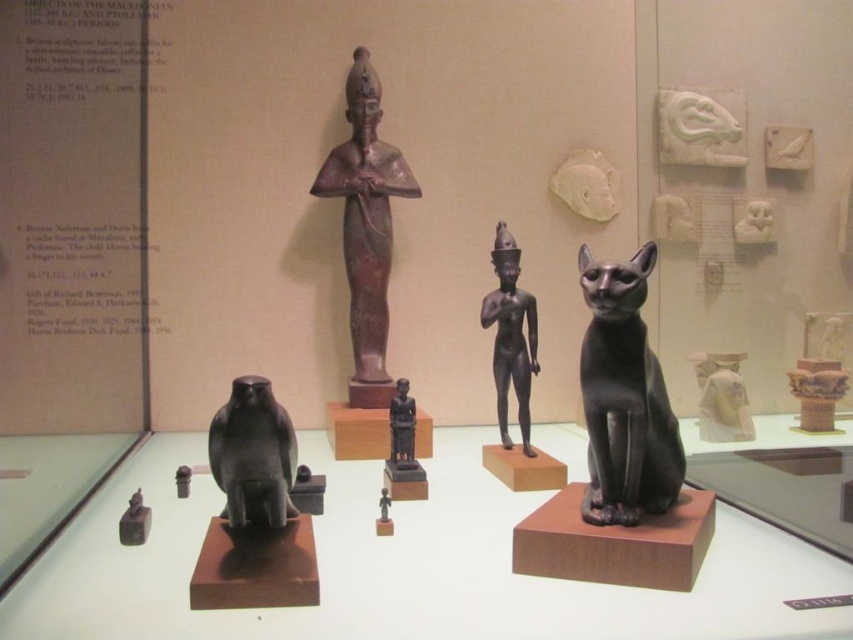
Is matte black cat at center below black glossy bird at lower left?

No, matte black cat at center is not below black glossy bird at lower left.

Is point (598, 310) positioned after point (279, 460)?

Yes, point (598, 310) is farther from viewer.

Where is `matte black cat at center`? matte black cat at center is located at coordinates (624, 397).

Does black glossy bird at lower left have a lesser height compared to black polished statue at center?

Indeed, black glossy bird at lower left has a lesser height compared to black polished statue at center.

Identify the location of black glossy bird at lower left. The image size is (853, 640). (253, 454).

At what (x,y) coordinates should I click in order to perform the action: click on black glossy bird at lower left. Please return your answer as a coordinate pair (x, y). This screenshot has height=640, width=853. Looking at the image, I should click on (253, 454).

Can you confirm if matte black cat at center is positioned above matte black figurine at center?

Correct, matte black cat at center is located above matte black figurine at center.

Is matte black cat at center positioned in front of matte black figurine at center?

Yes, it is.

Is point (668, 468) positioned before point (405, 410)?

Yes, point (668, 468) is in front of point (405, 410).

Where is `matte black cat at center`? The height and width of the screenshot is (640, 853). matte black cat at center is located at coordinates (624, 397).